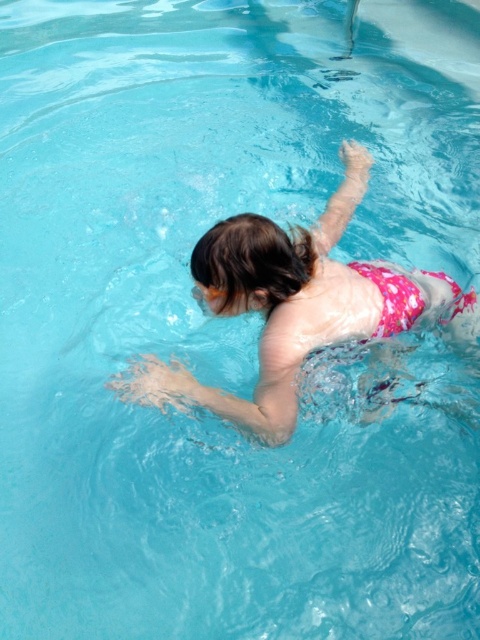
You are a lifeguard who needs to locate the swimmer in the pool. Based on the scene, where is the pink floral swimsuit at center relative to the transparent plastic goggles at upper center?

The pink floral swimsuit at center is above the transparent plastic goggles at upper center.

You are a lifeguard observing the pool area. You notice the pink floral swimsuit at center and the transparent plastic goggles at upper center. Which object is positioned higher in the image?

The transparent plastic goggles at upper center are positioned higher in the image than the pink floral swimsuit at center.